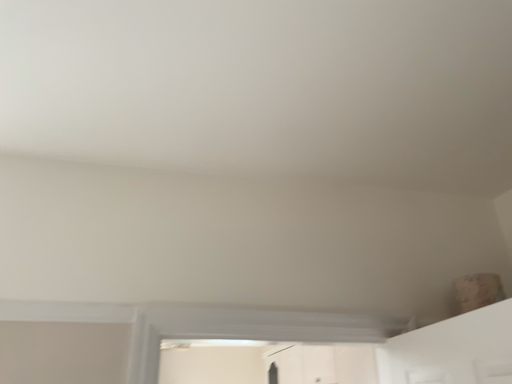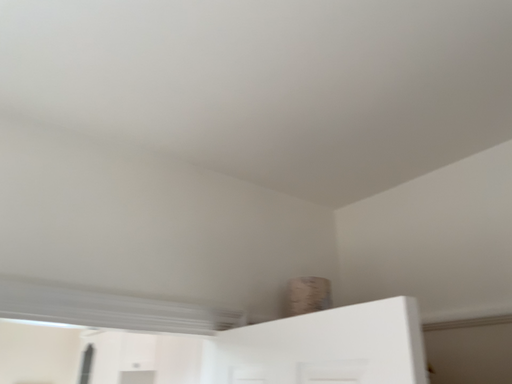
Question: How did the camera likely rotate when shooting the video?

Choices:
 (A) rotated right
 (B) rotated left

Answer: (A)